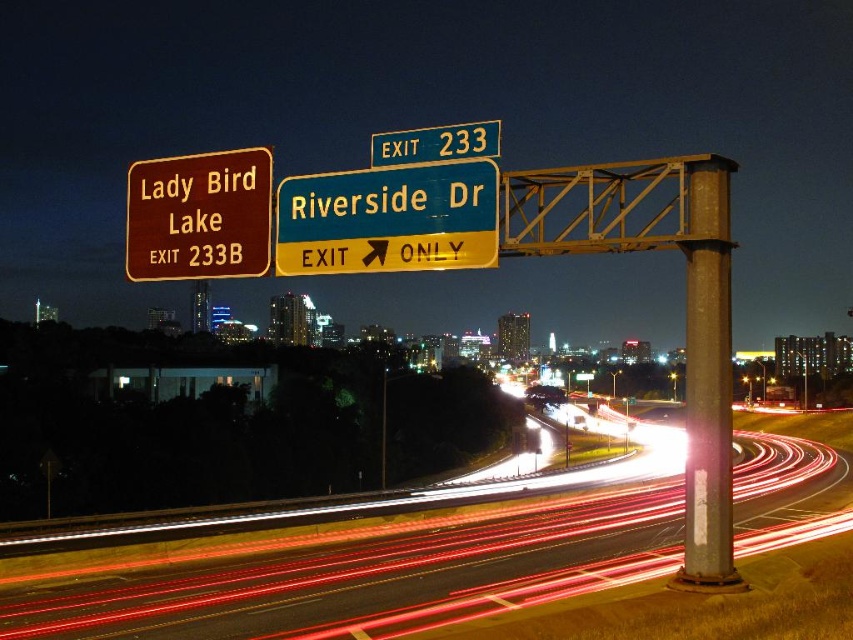
Question: Which point is closer to the camera?

Choices:
 (A) (165, 173)
 (B) (405, 145)
 (C) (703, 156)
 (D) (386, 212)

Answer: (D)

Question: Which point is closer to the camera?

Choices:
 (A) metallic gray pole at center-right
 (B) yellow/green plastic sign at upper center

Answer: (B)

Question: Is metallic gray pole at center-right bigger than yellow/golden metal/texture exit sign at upper center?

Choices:
 (A) yes
 (B) no

Answer: (A)

Question: Does white light trails at center appear on the left side of yellow/green plastic sign at upper center?

Choices:
 (A) no
 (B) yes

Answer: (A)

Question: Considering the real-world distances, which object is farthest from the metallic gray pole at center-right?

Choices:
 (A) white light trails at center
 (B) yellow/green plastic sign at upper center
 (C) yellow/golden metal/texture exit sign at upper center

Answer: (C)

Question: From the image, what is the correct spatial relationship of yellow/green plastic sign at upper center in relation to metallic gray pole at center-right?

Choices:
 (A) right
 (B) left

Answer: (B)